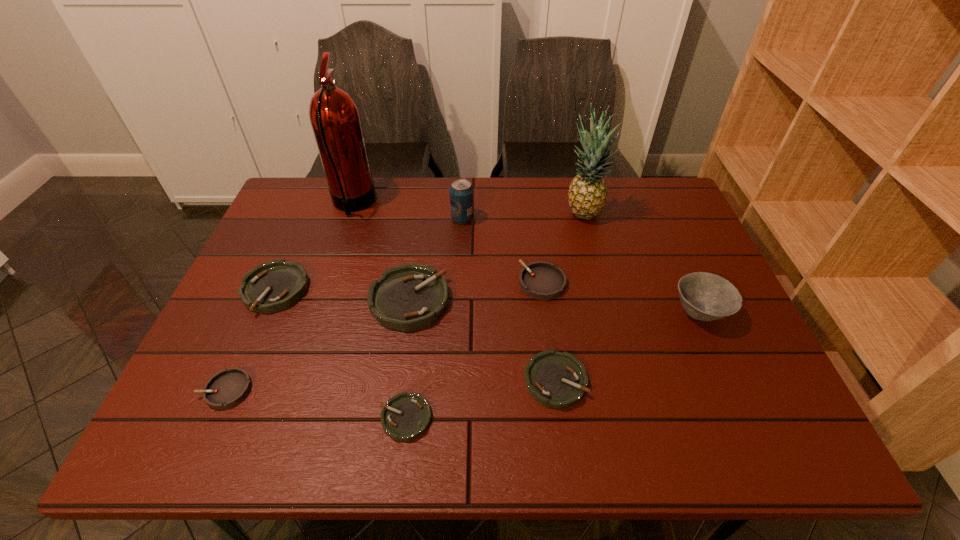
The width and height of the screenshot is (960, 540). I want to click on fire extinguisher, so click(334, 116).

I want to click on the tallest object, so click(334, 116).

In order to click on yellow pineapple in this screenshot , I will do `click(587, 196)`.

The width and height of the screenshot is (960, 540). Identify the location of the ninth object from left to right. (587, 196).

This screenshot has height=540, width=960. I want to click on pop soda, so click(x=461, y=192).

Identify the location of bowl. (704, 296).

The height and width of the screenshot is (540, 960). I want to click on the seventh shortest object, so click(x=704, y=296).

Image resolution: width=960 pixels, height=540 pixels. Find the location of `the biggest green ashtray`. the biggest green ashtray is located at coordinates (408, 297).

Where is `the farther gray ashtray`? the farther gray ashtray is located at coordinates (540, 280).

Find the location of a particular element. The image size is (960, 540). the bigger gray ashtray is located at coordinates (540, 280).